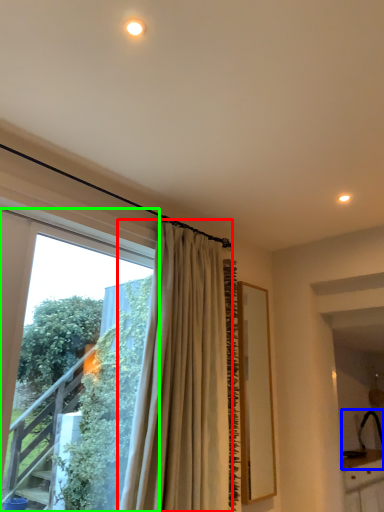
Question: Based on their relative distances, which object is farther from curtain (highlighted by a red box)? Choose from sink (highlighted by a blue box) and window (highlighted by a green box).

Choices:
 (A) sink
 (B) window

Answer: (A)